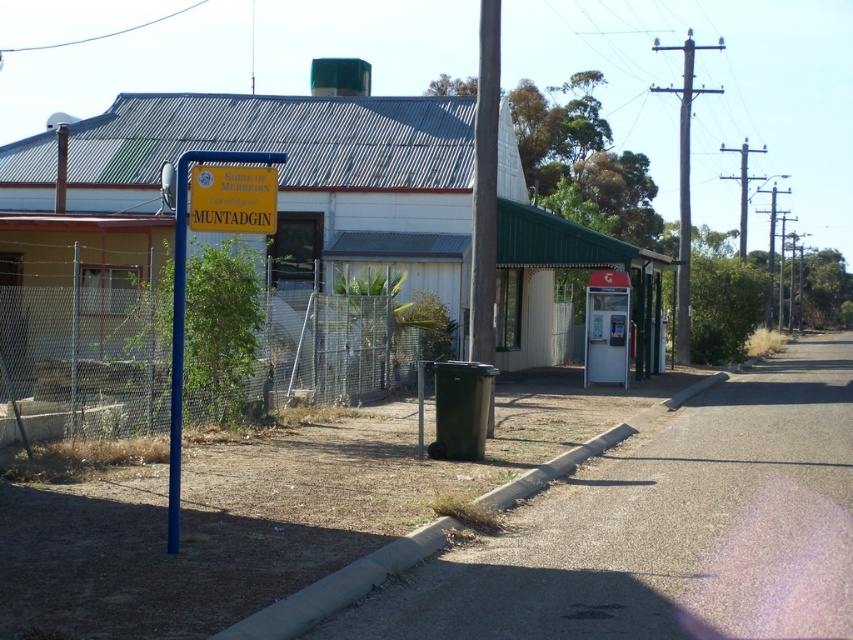
You are standing at the entrance of the building and want to reach the blue pole with the yellow sign. Which direction should you walk to avoid the wire mesh fence at left?

Since the wire mesh fence at left is located at point (277, 339), you should walk to the right to avoid the wire mesh fence at left and reach the blue pole with the yellow sign.